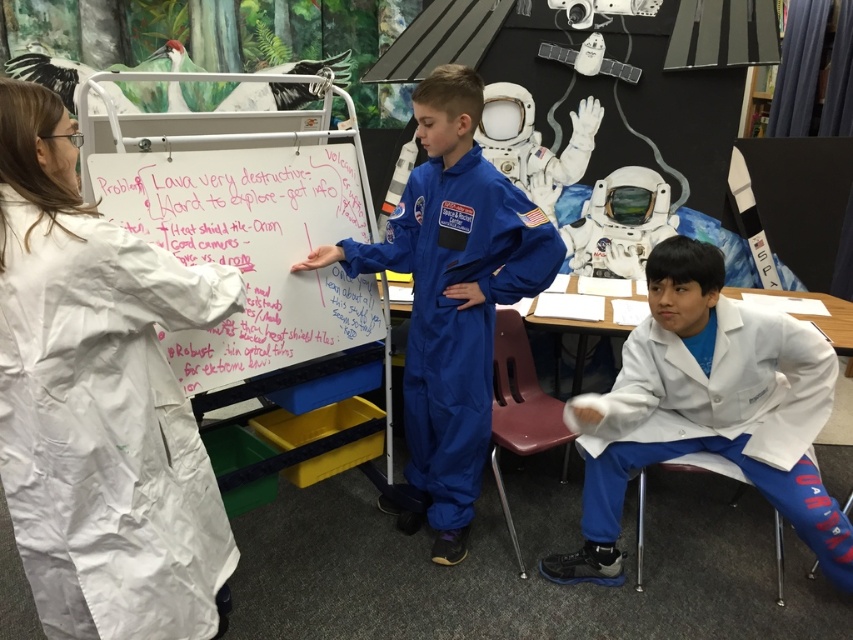
What is located at the coordinates point (451,296) in the classroom scene?

The blue smooth jumpsuit at center is located at point (451,296).

You are a student in the classroom and want to write a note on the whiteboard at center. To do so, you need to step around the white matte lab coat at lower right. Is there enough space between them for you to move freely?

The white matte lab coat at lower right is located below the whiteboard at center, so there is space between them for you to move freely around the white matte lab coat at lower right to reach the whiteboard at center.

You are a student in the classroom and want to write on the whiteboard at center without moving the blue smooth jumpsuit at center. Is there enough space between them for you to reach the whiteboard?

The blue smooth jumpsuit at center is 30.50 centimeters from the whiteboard at center. Since 30.50 centimeters is about the length of an average person arm, you can reach the whiteboard at center without moving the blue smooth jumpsuit at center.